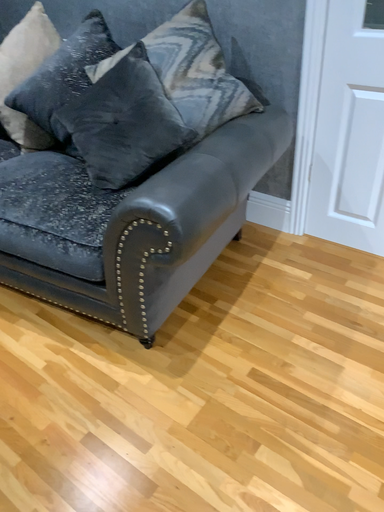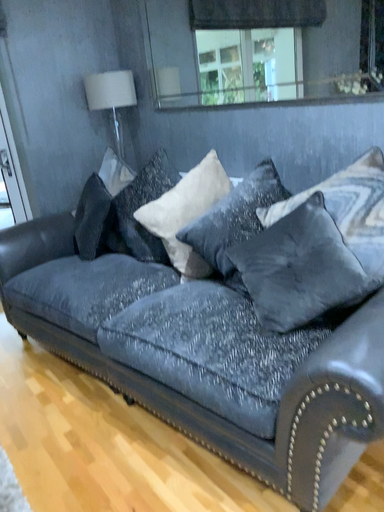
Question: How did the camera likely rotate when shooting the video?

Choices:
 (A) rotated left
 (B) rotated right

Answer: (A)